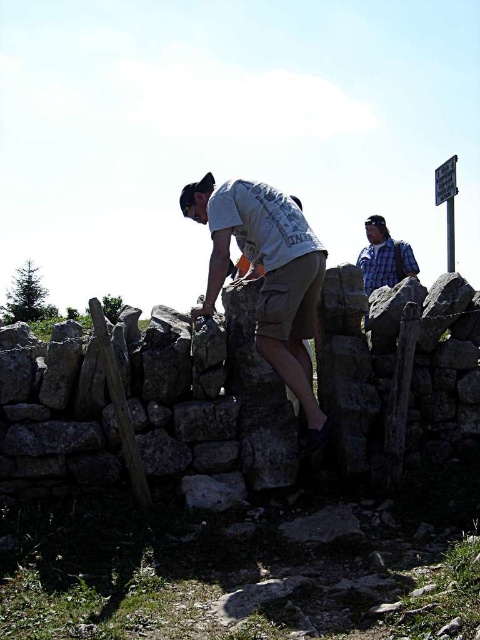
Which is below, light gray cotton shirt at center or blue plaid shirt at upper right?

light gray cotton shirt at center

Does light gray cotton shirt at center have a larger size compared to blue plaid shirt at upper right?

Correct, light gray cotton shirt at center is larger in size than blue plaid shirt at upper right.

Which is behind, point (290, 326) or point (369, 243)?

The point (369, 243) is more distant.

Find the location of a particular element. The image size is (480, 640). light gray cotton shirt at center is located at coordinates (266, 273).